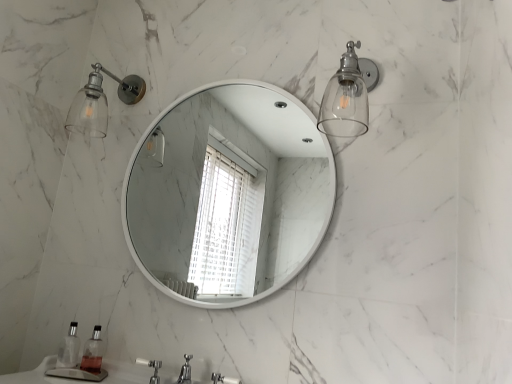
Describe the element at coordinates (152, 367) in the screenshot. I see `white plastic faucet at lower center` at that location.

Measure the distance between point (89, 89) and camera.

The depth of point (89, 89) is 1.78 meters.

Image resolution: width=512 pixels, height=384 pixels. What are the coordinates of `clear glass soap dispenser at lower left, positioned as the second soap dispenser in left-to-right order` in the screenshot? It's located at (93, 353).

Based on the photo, how much space does clear glass soap dispenser at lower left, positioned as the second soap dispenser in left-to-right order, occupy horizontally?

It is 2.51 inches.

Find the location of a particular element. The width and height of the screenshot is (512, 384). clear plastic soap dispenser at lower left, which ranks as the second soap dispenser in right-to-left order is located at coordinates (69, 348).

Measure the distance between white glossy mirror at center and camera.

white glossy mirror at center is 2.13 meters from camera.

The height and width of the screenshot is (384, 512). I want to click on white plastic faucet at lower center, so pos(152,367).

Can you confirm if clear glass sconce at upper left is bigger than clear glass soap dispenser at lower left, the 1th soap dispenser from the right?

Indeed, clear glass sconce at upper left has a larger size compared to clear glass soap dispenser at lower left, the 1th soap dispenser from the right.

Which is correct: clear glass sconce at upper left is inside clear glass soap dispenser at lower left, positioned as the second soap dispenser in left-to-right order, or outside of it?

clear glass sconce at upper left exists outside the volume of clear glass soap dispenser at lower left, positioned as the second soap dispenser in left-to-right order.

Which of these two, clear glass sconce at upper left or clear glass soap dispenser at lower left, the 1th soap dispenser from the right, stands taller?

clear glass sconce at upper left.

Is clear glass sconce at upper left wider or thinner than clear glass soap dispenser at lower left, the 1th soap dispenser from the right?

In the image, clear glass sconce at upper left appears to be wider than clear glass soap dispenser at lower left, the 1th soap dispenser from the right.

Who is taller, clear plastic soap dispenser at lower left, which ranks as the second soap dispenser in right-to-left order, or white plastic faucet at lower center?

clear plastic soap dispenser at lower left, which ranks as the second soap dispenser in right-to-left order.

Who is smaller, clear plastic soap dispenser at lower left, placed as the first soap dispenser when sorted from left to right, or white plastic faucet at lower center?

white plastic faucet at lower center is smaller.

Is clear plastic soap dispenser at lower left, which ranks as the second soap dispenser in right-to-left order, next to white plastic faucet at lower center?

clear plastic soap dispenser at lower left, which ranks as the second soap dispenser in right-to-left order, is not next to white plastic faucet at lower center, and they're not touching.

Would you say clear plastic soap dispenser at lower left, which ranks as the second soap dispenser in right-to-left order, contains clear glass soap dispenser at lower left, positioned as the second soap dispenser in left-to-right order?

No, clear glass soap dispenser at lower left, positioned as the second soap dispenser in left-to-right order, is located outside of clear plastic soap dispenser at lower left, which ranks as the second soap dispenser in right-to-left order.

Is clear plastic soap dispenser at lower left, placed as the first soap dispenser when sorted from left to right, positioned with its back to clear glass soap dispenser at lower left, positioned as the second soap dispenser in left-to-right order?

No, clear plastic soap dispenser at lower left, placed as the first soap dispenser when sorted from left to right,'s orientation is not away from clear glass soap dispenser at lower left, positioned as the second soap dispenser in left-to-right order.

Looking at this image, relative to clear glass soap dispenser at lower left, positioned as the second soap dispenser in left-to-right order, is clear plastic soap dispenser at lower left, which ranks as the second soap dispenser in right-to-left order, in front or behind?

clear plastic soap dispenser at lower left, which ranks as the second soap dispenser in right-to-left order, is behind clear glass soap dispenser at lower left, positioned as the second soap dispenser in left-to-right order.

Which point is more forward, (74, 326) or (100, 326)?

Positioned in front is point (100, 326).

Does clear glass soap dispenser at lower left, positioned as the second soap dispenser in left-to-right order, turn towards white glossy mirror at center?

No, clear glass soap dispenser at lower left, positioned as the second soap dispenser in left-to-right order, does not turn towards white glossy mirror at center.

Which object is thinner, clear glass soap dispenser at lower left, the 1th soap dispenser from the right, or white glossy mirror at center?

white glossy mirror at center.

From the image's perspective, would you say clear glass soap dispenser at lower left, positioned as the second soap dispenser in left-to-right order, is positioned over white glossy mirror at center?

Result: No, from the image's perspective, clear glass soap dispenser at lower left, positioned as the second soap dispenser in left-to-right order, is not above white glossy mirror at center.

Measure the distance between clear glass soap dispenser at lower left, the 1th soap dispenser from the right, and white glossy mirror at center.

The distance of clear glass soap dispenser at lower left, the 1th soap dispenser from the right, from white glossy mirror at center is 1.95 meters.

Does white plastic faucet at lower center have a lesser height compared to clear glass soap dispenser at lower left, the 1th soap dispenser from the right?

Correct, white plastic faucet at lower center is not as tall as clear glass soap dispenser at lower left, the 1th soap dispenser from the right.

You are a GUI agent. You are given a task and a screenshot of the screen. Output one action in this format:
    pyautogui.click(x=<x>, y=<y>)
    Task: Click on the 1st soap dispenser positioned above the white plastic faucet at lower center (from the image's perspective)
    Image resolution: width=512 pixels, height=384 pixels.
    Given the screenshot: What is the action you would take?
    pyautogui.click(x=93, y=353)

Is white plastic faucet at lower center oriented towards clear glass soap dispenser at lower left, positioned as the second soap dispenser in left-to-right order?

No.

Would you say white plastic faucet at lower center is inside or outside clear glass soap dispenser at lower left, the 1th soap dispenser from the right?

white plastic faucet at lower center is not inside clear glass soap dispenser at lower left, the 1th soap dispenser from the right, it's outside.

Starting from the clear glass sconce at upper right, which soap dispenser is the 1st one behind? Please provide its 2D coordinates.

[(93, 353)]

From a real-world perspective, is clear glass soap dispenser at lower left, the 1th soap dispenser from the right, above or below clear glass sconce at upper right?

clear glass soap dispenser at lower left, the 1th soap dispenser from the right, is situated lower than clear glass sconce at upper right in the real world.

Which object is further away from the camera, clear glass soap dispenser at lower left, positioned as the second soap dispenser in left-to-right order, or clear glass sconce at upper right?

clear glass soap dispenser at lower left, positioned as the second soap dispenser in left-to-right order, is behind.

Does clear glass soap dispenser at lower left, the 1th soap dispenser from the right, turn towards clear glass sconce at upper right?

No, clear glass soap dispenser at lower left, the 1th soap dispenser from the right, is not aimed at clear glass sconce at upper right.

Is clear glass sconce at upper left positioned far away from clear glass sconce at upper right?

Actually, clear glass sconce at upper left and clear glass sconce at upper right are a little close together.

Looking at this image, is clear glass sconce at upper left in front of or behind clear glass sconce at upper right in the image?

clear glass sconce at upper left is positioned farther from the viewer than clear glass sconce at upper right.

Looking at this image, from a real-world perspective, which is physically below, clear glass sconce at upper left or clear glass sconce at upper right?

In real-world perspective, clear glass sconce at upper right is lower.

From the image's perspective, does clear glass sconce at upper left appear higher than clear glass sconce at upper right?

Correct, clear glass sconce at upper left appears higher than clear glass sconce at upper right in the image.

Image resolution: width=512 pixels, height=384 pixels. In order to click on shower above the clear glass soap dispenser at lower left, the 1th soap dispenser from the right (from the image's perspective) in this screenshot , I will do `click(100, 102)`.

At what (x,y) coordinates should I click in order to perform the action: click on faucet in front of the clear plastic soap dispenser at lower left, which ranks as the second soap dispenser in right-to-left order. Please return your answer as a coordinate pair (x, y). Image resolution: width=512 pixels, height=384 pixels. Looking at the image, I should click on (152, 367).

Looking at the image, which one is located further to clear plastic soap dispenser at lower left, placed as the first soap dispenser when sorted from left to right, clear glass soap dispenser at lower left, the 1th soap dispenser from the right, or white plastic faucet at lower center?

The object further to clear plastic soap dispenser at lower left, placed as the first soap dispenser when sorted from left to right, is white plastic faucet at lower center.

Looking at this image, estimate the real-world distances between objects in this image. Which object is closer to clear glass sconce at upper right, clear glass soap dispenser at lower left, positioned as the second soap dispenser in left-to-right order, or clear plastic soap dispenser at lower left, placed as the first soap dispenser when sorted from left to right?

The object closer to clear glass sconce at upper right is clear glass soap dispenser at lower left, positioned as the second soap dispenser in left-to-right order.

Estimate the real-world distances between objects in this image. Which object is further from white glossy mirror at center, clear plastic soap dispenser at lower left, which ranks as the second soap dispenser in right-to-left order, or clear glass sconce at upper left?

clear plastic soap dispenser at lower left, which ranks as the second soap dispenser in right-to-left order.

Consider the image. Which object lies nearer to the anchor point clear glass sconce at upper right, white glossy mirror at center or clear glass soap dispenser at lower left, the 1th soap dispenser from the right?

The object closer to clear glass sconce at upper right is clear glass soap dispenser at lower left, the 1th soap dispenser from the right.

From the image, which object appears to be farther from clear plastic soap dispenser at lower left, placed as the first soap dispenser when sorted from left to right, clear glass sconce at upper left or white plastic faucet at lower center?

clear glass sconce at upper left is further to clear plastic soap dispenser at lower left, placed as the first soap dispenser when sorted from left to right.

Looking at the image, which one is located further to white plastic faucet at lower center, clear glass sconce at upper right or clear glass sconce at upper left?

clear glass sconce at upper right is positioned further to the anchor white plastic faucet at lower center.

Based on their spatial positions, is clear glass sconce at upper left or white plastic faucet at lower center further from white glossy mirror at center?

white plastic faucet at lower center is further to white glossy mirror at center.

Estimate the real-world distances between objects in this image. Which object is further from clear glass sconce at upper right, white plastic faucet at lower center or clear glass sconce at upper left?

white plastic faucet at lower center is positioned further to the anchor clear glass sconce at upper right.

Identify the location of soap dispenser located between clear plastic soap dispenser at lower left, placed as the first soap dispenser when sorted from left to right, and white plastic faucet at lower center in the left-right direction. (93, 353).

This screenshot has height=384, width=512. In order to click on mirror between clear glass sconce at upper left and clear glass soap dispenser at lower left, positioned as the second soap dispenser in left-to-right order, vertically in this screenshot , I will do `click(228, 193)`.

What are the coordinates of `soap dispenser between white glossy mirror at center and clear glass soap dispenser at lower left, the 1th soap dispenser from the right, vertically` in the screenshot? It's located at (x=69, y=348).

Find the location of a particular element. soap dispenser between clear plastic soap dispenser at lower left, placed as the first soap dispenser when sorted from left to right, and clear glass sconce at upper right is located at coordinates (93, 353).